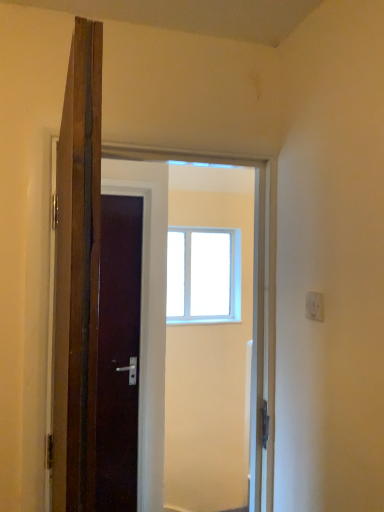
Question: Is transparent glass window at center not within white plastic electric outlet at upper right?

Choices:
 (A) yes
 (B) no

Answer: (A)

Question: Can you confirm if transparent glass window at center is smaller than white plastic electric outlet at upper right?

Choices:
 (A) no
 (B) yes

Answer: (A)

Question: Considering the relative sizes of transparent glass window at center and white plastic electric outlet at upper right in the image provided, is transparent glass window at center taller than white plastic electric outlet at upper right?

Choices:
 (A) no
 (B) yes

Answer: (B)

Question: Considering the relative positions of transparent glass window at center and white plastic electric outlet at upper right in the image provided, is transparent glass window at center to the right of white plastic electric outlet at upper right from the viewer's perspective?

Choices:
 (A) yes
 (B) no

Answer: (B)

Question: From a real-world perspective, is transparent glass window at center below white plastic electric outlet at upper right?

Choices:
 (A) yes
 (B) no

Answer: (B)

Question: Is transparent glass window at center positioned behind white plastic electric outlet at upper right?

Choices:
 (A) yes
 (B) no

Answer: (A)

Question: Does white plastic electric outlet at upper right have a lesser height compared to transparent glass window at center?

Choices:
 (A) yes
 (B) no

Answer: (A)

Question: Could transparent glass window at center be considered to be inside white plastic electric outlet at upper right?

Choices:
 (A) no
 (B) yes

Answer: (A)

Question: Is white plastic electric outlet at upper right outside transparent glass window at center?

Choices:
 (A) no
 (B) yes

Answer: (B)

Question: Is the position of white plastic electric outlet at upper right more distant than that of transparent glass window at center?

Choices:
 (A) no
 (B) yes

Answer: (A)

Question: Considering the relative sizes of white plastic electric outlet at upper right and transparent glass window at center in the image provided, is white plastic electric outlet at upper right taller than transparent glass window at center?

Choices:
 (A) no
 (B) yes

Answer: (A)

Question: Considering the relative sizes of white plastic electric outlet at upper right and transparent glass window at center in the image provided, is white plastic electric outlet at upper right smaller than transparent glass window at center?

Choices:
 (A) yes
 (B) no

Answer: (A)

Question: Considering the positions of white plastic electric outlet at upper right and transparent glass window at center in the image, is white plastic electric outlet at upper right bigger or smaller than transparent glass window at center?

Choices:
 (A) big
 (B) small

Answer: (B)